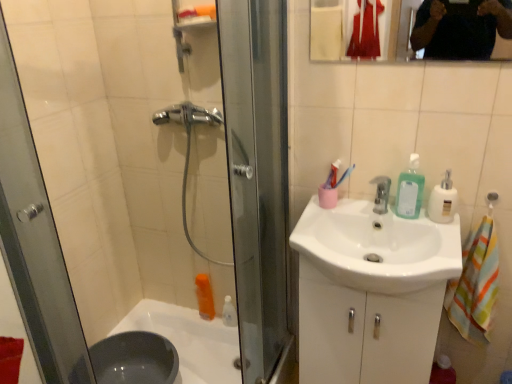
Question: Does white plastic soap dispenser at right have a smaller size compared to silver metallic faucet at center?

Choices:
 (A) yes
 (B) no

Answer: (B)

Question: Does white plastic soap dispenser at right have a lesser height compared to silver metallic faucet at center?

Choices:
 (A) no
 (B) yes

Answer: (A)

Question: From a real-world perspective, is white plastic soap dispenser at right positioned under silver metallic faucet at center based on gravity?

Choices:
 (A) yes
 (B) no

Answer: (B)

Question: Is white plastic soap dispenser at right positioned in front of silver metallic faucet at center?

Choices:
 (A) yes
 (B) no

Answer: (A)

Question: Considering the relative sizes of white plastic soap dispenser at right and silver metallic faucet at center in the image provided, is white plastic soap dispenser at right thinner than silver metallic faucet at center?

Choices:
 (A) yes
 (B) no

Answer: (A)

Question: Is green translucent liquid soap at upper right inside or outside of white plastic soap dispenser at right?

Choices:
 (A) inside
 (B) outside

Answer: (B)

Question: Is green translucent liquid soap at upper right wider or thinner than white plastic soap dispenser at right?

Choices:
 (A) thin
 (B) wide

Answer: (A)

Question: From their relative heights in the image, would you say green translucent liquid soap at upper right is taller or shorter than white plastic soap dispenser at right?

Choices:
 (A) short
 (B) tall

Answer: (B)

Question: From a real-world perspective, is green translucent liquid soap at upper right physically located above or below white plastic soap dispenser at right?

Choices:
 (A) above
 (B) below

Answer: (A)

Question: From the image's perspective, is silver metallic faucet at center located above or below green translucent liquid soap at upper right?

Choices:
 (A) above
 (B) below

Answer: (B)

Question: From a real-world perspective, relative to green translucent liquid soap at upper right, is silver metallic faucet at center vertically above or below?

Choices:
 (A) below
 (B) above

Answer: (A)

Question: Considering their positions, is silver metallic faucet at center located in front of or behind green translucent liquid soap at upper right?

Choices:
 (A) front
 (B) behind

Answer: (A)

Question: Is silver metallic faucet at center to the left or to the right of green translucent liquid soap at upper right in the image?

Choices:
 (A) right
 (B) left

Answer: (B)

Question: Relative to white glossy sink at center, is green translucent liquid soap at upper right in front or behind?

Choices:
 (A) front
 (B) behind

Answer: (B)

Question: Considering the positions of green translucent liquid soap at upper right and white glossy sink at center in the image, is green translucent liquid soap at upper right bigger or smaller than white glossy sink at center?

Choices:
 (A) small
 (B) big

Answer: (A)